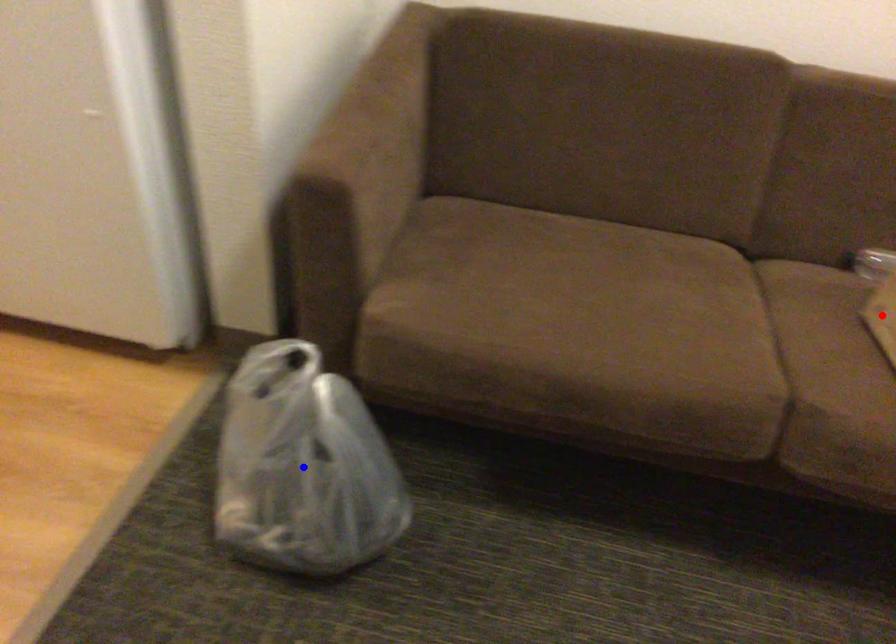
Question: Two points are marked on the image. Which point is closer to the camera?

Choices:
 (A) Blue point is closer.
 (B) Red point is closer.

Answer: (A)